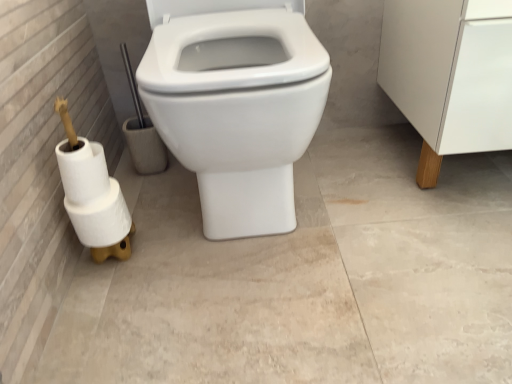
Question: Can you confirm if white matte toilet paper at lower left, the 1th toilet paper ordered from the bottom, is wider than white wood cabinet leg at right?

Choices:
 (A) yes
 (B) no

Answer: (B)

Question: Can you confirm if white matte toilet paper at lower left, the third toilet paper from the top, is smaller than white wood cabinet leg at right?

Choices:
 (A) yes
 (B) no

Answer: (A)

Question: Does white matte toilet paper at lower left, the 1th toilet paper ordered from the bottom, have a larger size compared to white wood cabinet leg at right?

Choices:
 (A) yes
 (B) no

Answer: (B)

Question: Is white matte toilet paper at lower left, the third toilet paper from the top, not near white wood cabinet leg at right?

Choices:
 (A) yes
 (B) no

Answer: (B)

Question: From a real-world perspective, is white matte toilet paper at lower left, the third toilet paper from the top, located beneath white wood cabinet leg at right?

Choices:
 (A) no
 (B) yes

Answer: (B)

Question: Considering the positions of white glossy toilet at center and white matte toilet paper at left, which is the 2th toilet paper from top to bottom, in the image, is white glossy toilet at center taller or shorter than white matte toilet paper at left, which is the 2th toilet paper from top to bottom,?

Choices:
 (A) short
 (B) tall

Answer: (B)

Question: From the image's perspective, relative to white matte toilet paper at left, which is the 2th toilet paper from top to bottom, is white glossy toilet at center above or below?

Choices:
 (A) below
 (B) above

Answer: (B)

Question: From a real-world perspective, is white glossy toilet at center positioned above or below white matte toilet paper at left, which ranks as the second toilet paper in bottom-to-top order?

Choices:
 (A) above
 (B) below

Answer: (A)

Question: Would you say white glossy toilet at center is to the left or to the right of white matte toilet paper at left, which ranks as the second toilet paper in bottom-to-top order, in the picture?

Choices:
 (A) right
 (B) left

Answer: (A)

Question: Is white matte toilet paper at lower left, placed as the first toilet paper when sorted from top to bottom, wider or thinner than white matte toilet paper at lower left, the 1th toilet paper ordered from the bottom?

Choices:
 (A) thin
 (B) wide

Answer: (A)

Question: From a real-world perspective, is white matte toilet paper at lower left, which is counted as the third toilet paper, starting from the bottom, above or below white matte toilet paper at lower left, the 1th toilet paper ordered from the bottom?

Choices:
 (A) below
 (B) above

Answer: (B)

Question: In terms of height, does white matte toilet paper at lower left, placed as the first toilet paper when sorted from top to bottom, look taller or shorter compared to white matte toilet paper at lower left, the third toilet paper from the top?

Choices:
 (A) tall
 (B) short

Answer: (A)

Question: Which is correct: white matte toilet paper at lower left, which is counted as the third toilet paper, starting from the bottom, is inside white matte toilet paper at lower left, the 1th toilet paper ordered from the bottom, or outside of it?

Choices:
 (A) outside
 (B) inside

Answer: (A)

Question: From their relative heights in the image, would you say white matte toilet paper at left, which ranks as the second toilet paper in bottom-to-top order, is taller or shorter than white wood cabinet leg at right?

Choices:
 (A) short
 (B) tall

Answer: (A)

Question: Choose the correct answer: Is white matte toilet paper at left, which is the 2th toilet paper from top to bottom, inside white wood cabinet leg at right or outside it?

Choices:
 (A) inside
 (B) outside

Answer: (B)